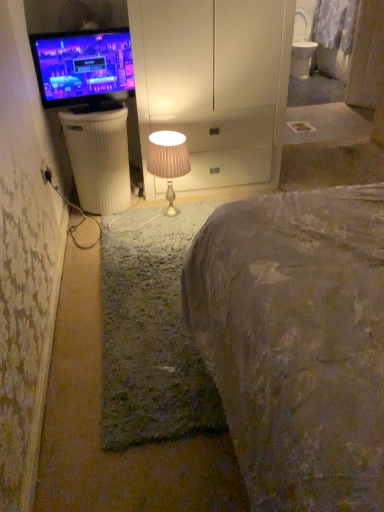
Question: Is white ribbed plastic trash bin/can at left smaller than black plastic electric outlet at lower left?

Choices:
 (A) yes
 (B) no

Answer: (B)

Question: Does white ribbed plastic trash bin/can at left appear on the right side of black plastic electric outlet at lower left?

Choices:
 (A) yes
 (B) no

Answer: (A)

Question: Considering the relative sizes of white ribbed plastic trash bin/can at left and black plastic electric outlet at lower left in the image provided, is white ribbed plastic trash bin/can at left taller than black plastic electric outlet at lower left?

Choices:
 (A) no
 (B) yes

Answer: (B)

Question: From the image's perspective, does white ribbed plastic trash bin/can at left appear lower than black plastic electric outlet at lower left?

Choices:
 (A) no
 (B) yes

Answer: (A)

Question: Is white ribbed plastic trash bin/can at left thinner than black plastic electric outlet at lower left?

Choices:
 (A) no
 (B) yes

Answer: (A)

Question: Is matte black tv at left to the left or to the right of white ribbed plastic trash bin/can at left in the image?

Choices:
 (A) right
 (B) left

Answer: (B)

Question: Considering their positions, is matte black tv at left located in front of or behind white ribbed plastic trash bin/can at left?

Choices:
 (A) front
 (B) behind

Answer: (A)

Question: Does point (86, 58) appear closer or farther from the camera than point (102, 167)?

Choices:
 (A) closer
 (B) farther

Answer: (A)

Question: From a real-world perspective, is matte black tv at left above or below white ribbed plastic trash bin/can at left?

Choices:
 (A) below
 (B) above

Answer: (B)

Question: Based on their positions, is white ribbed plastic trash bin/can at left located to the left or right of matte beige lampshade at center?

Choices:
 (A) left
 (B) right

Answer: (A)

Question: Is point (104, 174) closer or farther from the camera than point (160, 138)?

Choices:
 (A) farther
 (B) closer

Answer: (A)

Question: Is white ribbed plastic trash bin/can at left inside or outside of matte beige lampshade at center?

Choices:
 (A) outside
 (B) inside

Answer: (A)

Question: Looking at the image, does white ribbed plastic trash bin/can at left seem bigger or smaller compared to matte beige lampshade at center?

Choices:
 (A) small
 (B) big

Answer: (B)

Question: From a real-world perspective, is black plastic electric outlet at lower left physically located above or below matte black tv at left?

Choices:
 (A) below
 (B) above

Answer: (A)

Question: Considering the positions of black plastic electric outlet at lower left and matte black tv at left in the image, is black plastic electric outlet at lower left taller or shorter than matte black tv at left?

Choices:
 (A) short
 (B) tall

Answer: (A)